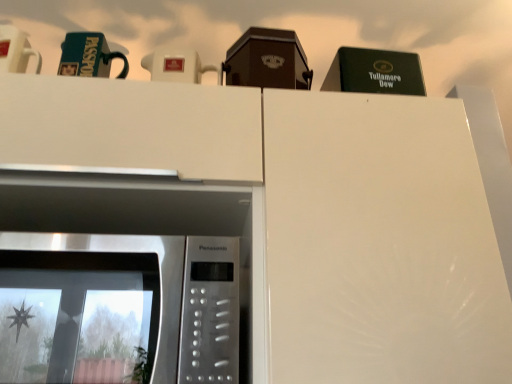
Describe the element at coordinates (118, 309) in the screenshot. I see `satin silver microwave at lower left` at that location.

Locate an element on the screen. satin silver microwave at lower left is located at coordinates (118, 309).

Locate an element on the screen. This screenshot has width=512, height=384. satin silver microwave at lower left is located at coordinates (118, 309).